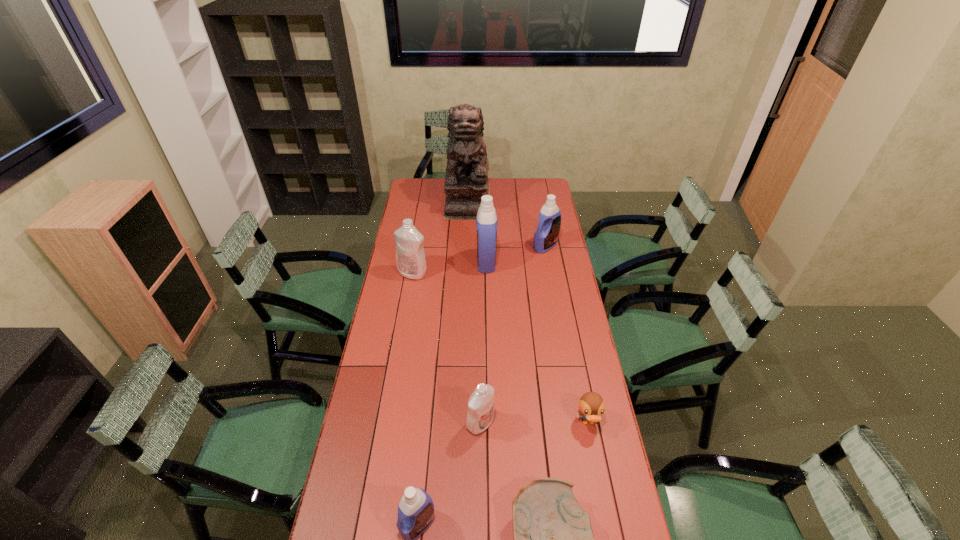
The image size is (960, 540). Find the location of `blue duck`. blue duck is located at coordinates (591, 405).

This screenshot has width=960, height=540. In order to click on duck in this screenshot , I will do `click(591, 405)`.

The height and width of the screenshot is (540, 960). Identify the location of vacant space located 0.090m on the front-facing side of the tallest object. pos(467,230).

The height and width of the screenshot is (540, 960). Identify the location of free spot located on the back of the biggest blue detergent. (486, 238).

Image resolution: width=960 pixels, height=540 pixels. Find the location of `blank area located 0.320m on the back of the leftmost detergent`. blank area located 0.320m on the back of the leftmost detergent is located at coordinates (420, 227).

Identify the location of vacant space located on the front of the second biggest blue detergent. (551, 276).

Where is `free space located 0.140m on the left of the right white detergent`? This screenshot has height=540, width=960. free space located 0.140m on the left of the right white detergent is located at coordinates 426,423.

Identify the location of free spot located 0.210m on the front-facing side of the seventh tallest object. The width and height of the screenshot is (960, 540). (604, 501).

The image size is (960, 540). In order to click on object that is positioned at the far edge in this screenshot , I will do `click(466, 181)`.

This screenshot has height=540, width=960. In order to click on object present at the left edge in this screenshot , I will do `click(410, 258)`.